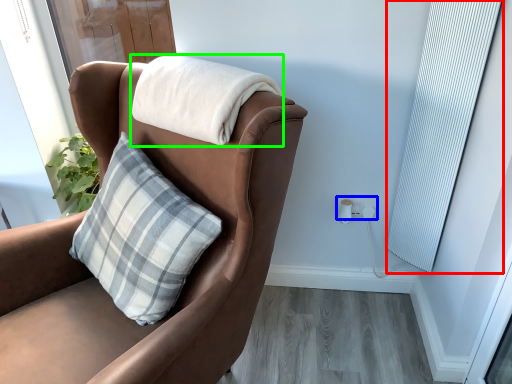
Question: Which object is positioned farthest from curtain (highlighted by a red box)? Select from electric outlet (highlighted by a blue box) and blanket (highlighted by a green box).

Choices:
 (A) electric outlet
 (B) blanket

Answer: (B)